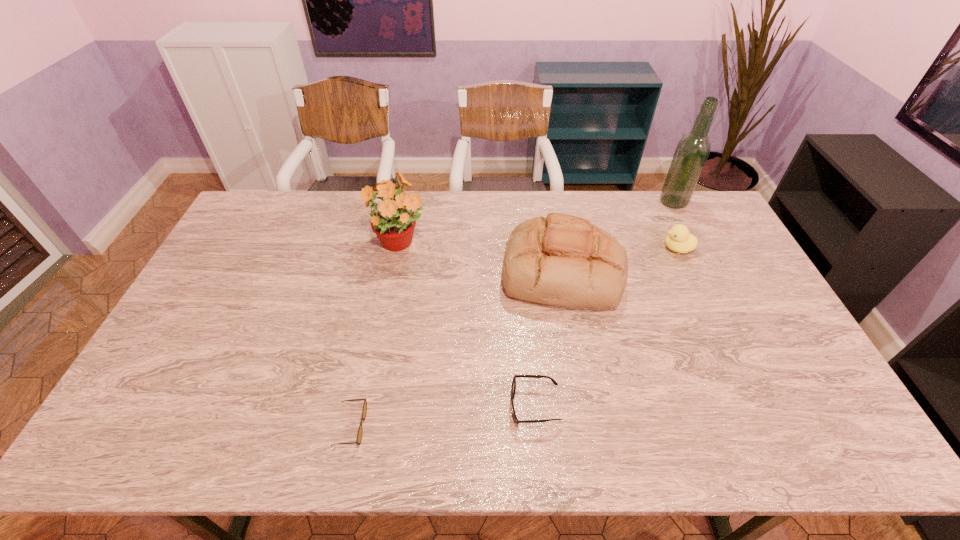
Where is `the tallest object`? the tallest object is located at coordinates (692, 151).

Where is `the farthest object`? The width and height of the screenshot is (960, 540). the farthest object is located at coordinates (692, 151).

What are the coordinates of `flowerpot` in the screenshot? It's located at (394, 222).

I want to click on the fourth shortest object, so click(x=561, y=260).

Where is `the third shortest object`? the third shortest object is located at coordinates (679, 239).

Identify the location of the right sunglasses. (513, 388).

This screenshot has width=960, height=540. Find the location of `the left sunglasses`. the left sunglasses is located at coordinates (364, 411).

The width and height of the screenshot is (960, 540). In order to click on blank space located 0.070m on the left of the tallest object in this screenshot , I will do `click(641, 202)`.

Locate an element on the screen. Image resolution: width=960 pixels, height=540 pixels. vacant space located 0.400m on the front of the second tallest object is located at coordinates (375, 371).

At what (x,y) coordinates should I click in order to perform the action: click on vacant space situated on the left of the bread. Please return your answer as a coordinate pair (x, y). The width and height of the screenshot is (960, 540). Looking at the image, I should click on pos(377,271).